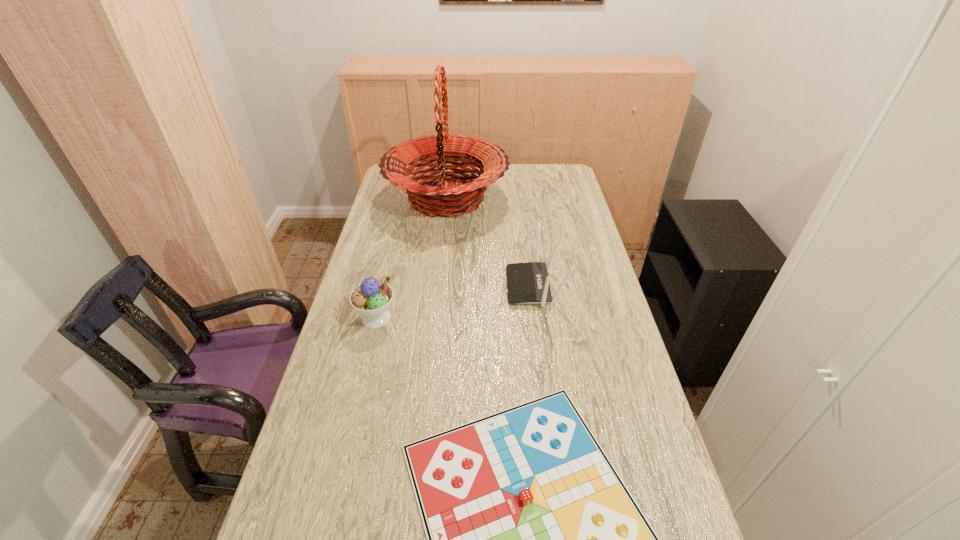
Where is `basket that is at the left edge`? The image size is (960, 540). basket that is at the left edge is located at coordinates (447, 197).

You are a GUI agent. You are given a task and a screenshot of the screen. Output one action in this format:
    pyautogui.click(x=<x>, y=<y>)
    Task: Click on the icecream located in the left edge section of the desktop
    The width and height of the screenshot is (960, 540).
    Given the screenshot: What is the action you would take?
    pyautogui.click(x=372, y=298)

Locate an element on the screen. The image size is (960, 540). object at the right edge is located at coordinates (528, 283).

The height and width of the screenshot is (540, 960). What are the coordinates of `object that is at the far left corner` in the screenshot? It's located at (447, 197).

Where is `free space at the left edge`? free space at the left edge is located at coordinates (396, 252).

Where is `vacant region at the right edge of the desktop`? This screenshot has height=540, width=960. vacant region at the right edge of the desktop is located at coordinates (585, 253).

Where is `free space at the far right corner`? free space at the far right corner is located at coordinates (565, 186).

Locate an element on the screen. Image resolution: width=960 pixels, height=540 pixels. free space between the tallest object and the icecream is located at coordinates point(412,258).

I want to click on free spot between the icecream and the router, so click(456, 302).

The width and height of the screenshot is (960, 540). I want to click on free point between the router and the basket, so [x=491, y=242].